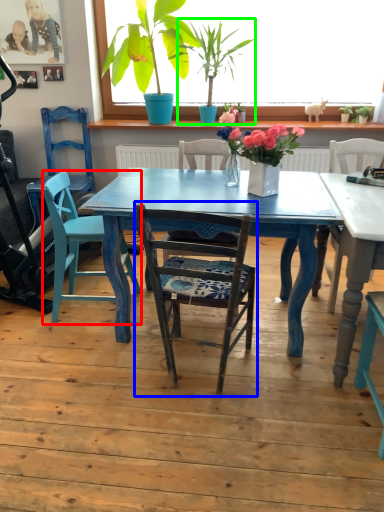
Question: Based on their relative distances, which object is farther from swivel chair (highlighted by a red box)? Choose from chair (highlighted by a blue box) and houseplant (highlighted by a green box).

Choices:
 (A) chair
 (B) houseplant

Answer: (B)